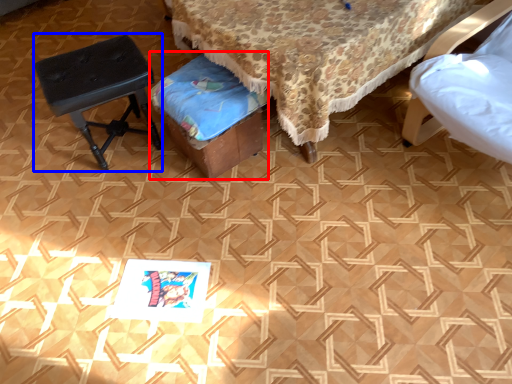
Question: Which point is closer to the camera, music stool (highlighted by a red box) or stool (highlighted by a blue box)?

Choices:
 (A) music stool
 (B) stool

Answer: (A)